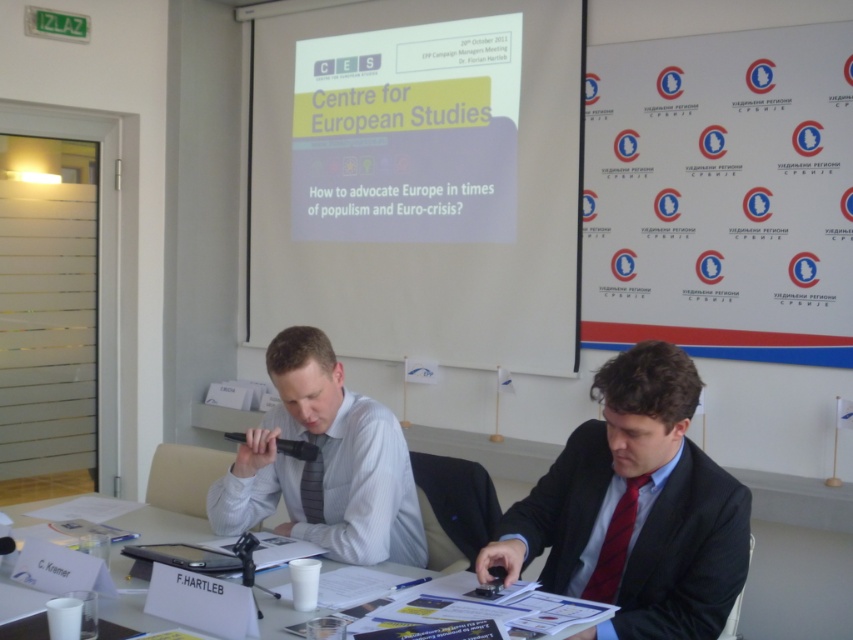
Is white striped shirt at center positioned behind white paper at center?

That is True.

Is point (384, 424) positioned behind point (328, 564)?

Yes, it is.

This screenshot has height=640, width=853. Identify the location of white striped shirt at center. (323, 461).

Between point (144, 506) and point (585, 595), which one is positioned behind?

The point (144, 506) is behind.

Is white paper at center smaller than red satin tie at lower right?

No.

Is point (190, 529) behind point (614, 582)?

Yes, point (190, 529) is behind point (614, 582).

The height and width of the screenshot is (640, 853). I want to click on white paper at center, so click(x=164, y=524).

Between point (379, 408) and point (308, 520), which one is positioned behind?

Positioned behind is point (308, 520).

The height and width of the screenshot is (640, 853). What do you see at coordinates (323, 461) in the screenshot?
I see `white striped shirt at center` at bounding box center [323, 461].

The width and height of the screenshot is (853, 640). I want to click on white striped shirt at center, so click(323, 461).